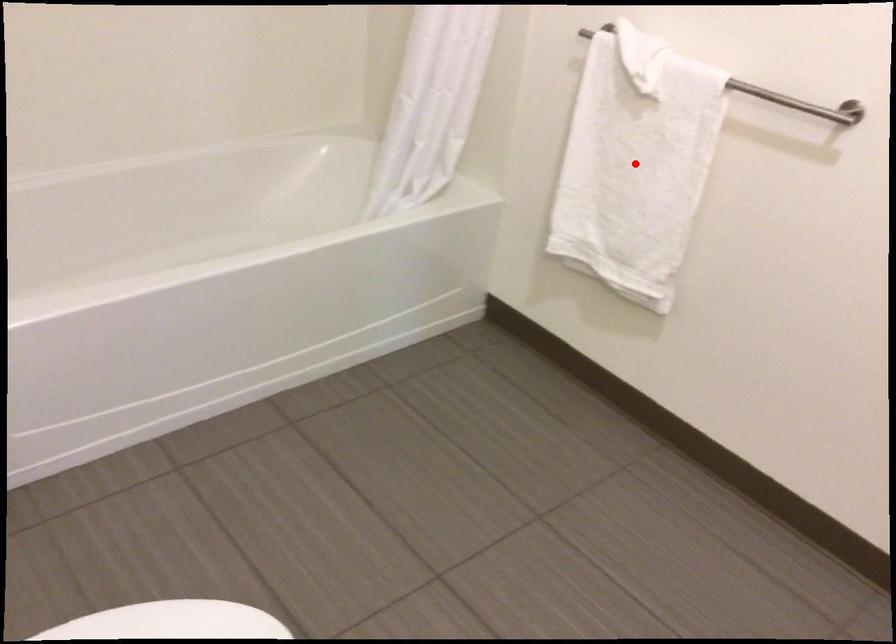
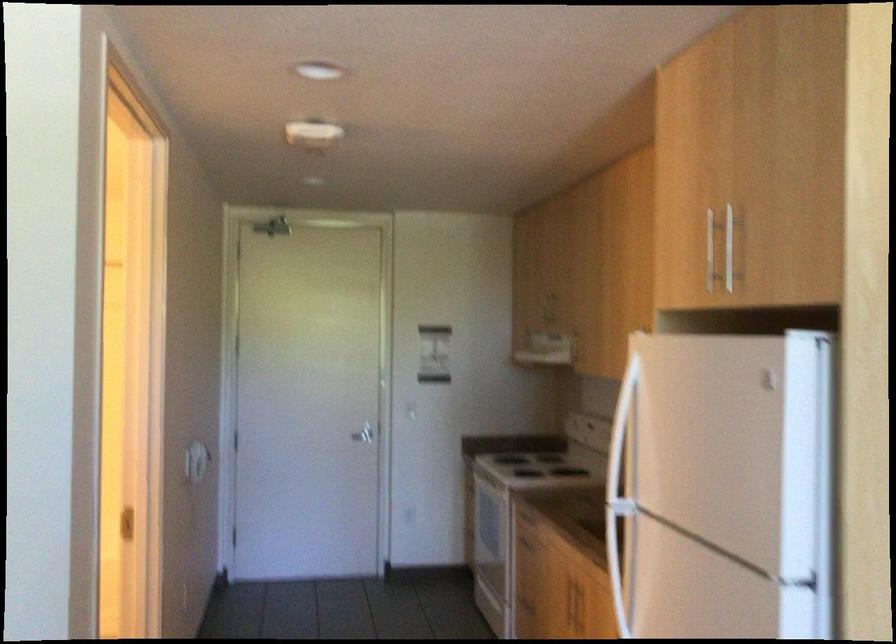
Question: I am providing you with two images of the same scene from different viewpoints. A red point is marked on the first image. At the location where the point appears in image 1, is it still visible in image 2?

Choices:
 (A) Yes
 (B) No

Answer: (B)